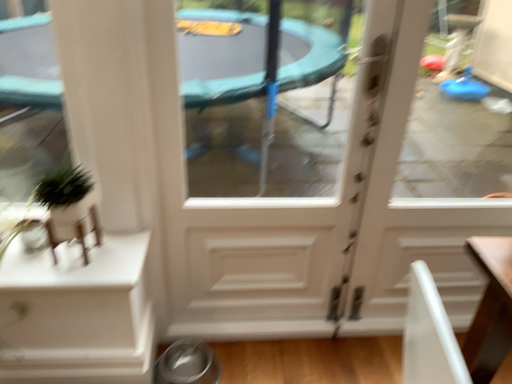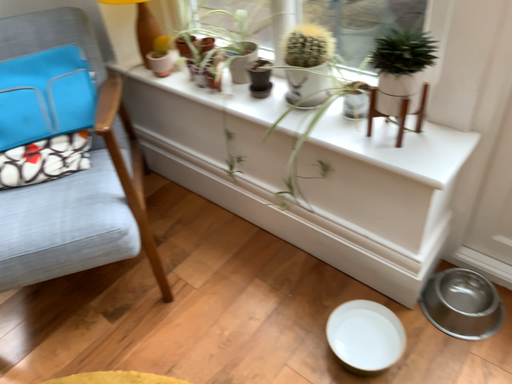
Question: How did the camera likely rotate when shooting the video?

Choices:
 (A) rotated right
 (B) rotated left

Answer: (B)